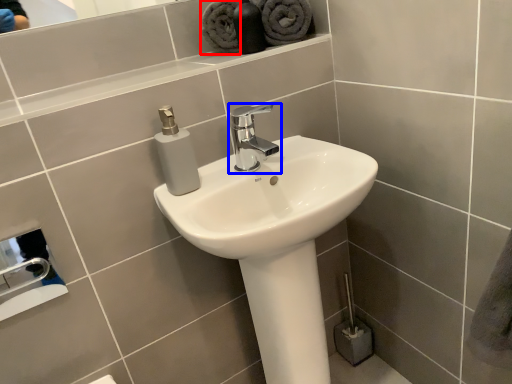
Question: Which point is further to the camera, bath towel (highlighted by a red box) or tap (highlighted by a blue box)?

Choices:
 (A) bath towel
 (B) tap

Answer: (A)